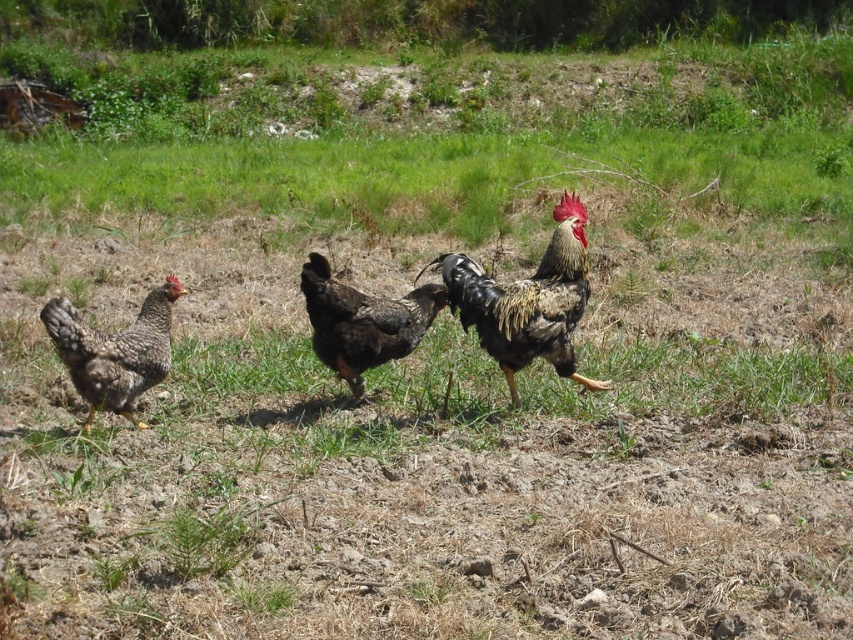
You are standing in the field and want to approach the black glossy rooster at center. Based on its position coordinates, can you estimate how far it is from the left edge of the field?

The black glossy rooster at center is positioned at coordinates point (x=527, y=301), so it is approximately 47.2 percent of the field width from the left edge.

You are standing in the middle of the field and see the three chickens. There is a point marked at coordinates (527, 301). Which chicken is located at this point?

The point at (527, 301) marks the black glossy rooster at center.